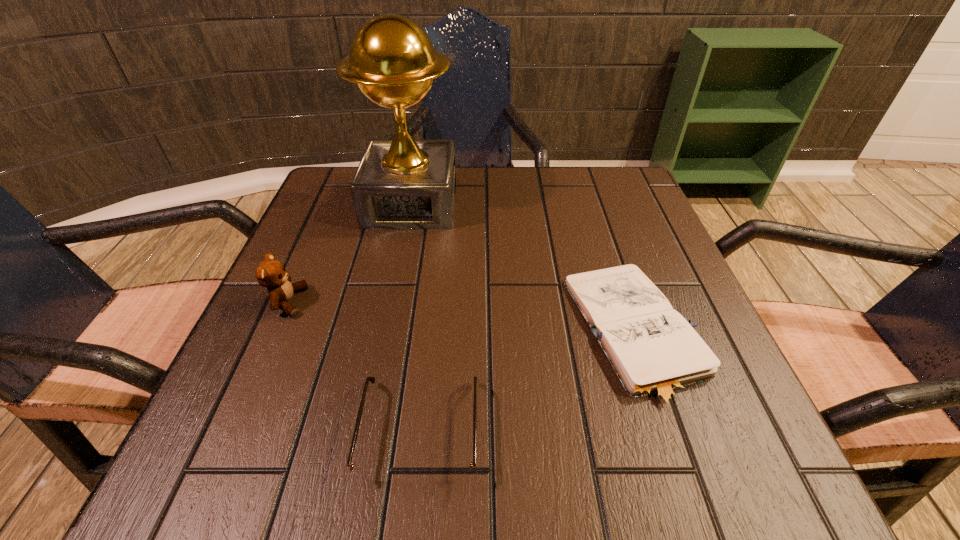
The image size is (960, 540). Find the location of `the farthest object`. the farthest object is located at coordinates (403, 183).

This screenshot has height=540, width=960. What are the coordinates of `award` in the screenshot? It's located at (403, 183).

This screenshot has height=540, width=960. I want to click on the third shortest object, so [270, 273].

You are a GUI agent. You are given a task and a screenshot of the screen. Output one action in this format:
    pyautogui.click(x=<x>, y=<y>)
    Task: Click on the teddy bear
    
    Given the screenshot: What is the action you would take?
    pyautogui.click(x=270, y=273)

Where is `the third tallest object`? the third tallest object is located at coordinates (371, 474).

This screenshot has height=540, width=960. Identify the location of notebook. click(x=655, y=353).

Identify the location of the rightmost object. The image size is (960, 540). (655, 353).

Locate an element on the screen. This screenshot has height=540, width=960. free space located 0.100m on the front-facing side of the farthest object is located at coordinates (399, 262).

You are a GUI agent. You are given a task and a screenshot of the screen. Output one action in this format:
    pyautogui.click(x=<x>, y=<y>)
    Task: Click on the free spot located 0.360m on the front-facing side of the leftmost object
    This screenshot has width=960, height=540.
    Given the screenshot: What is the action you would take?
    pyautogui.click(x=510, y=302)

Where is `free spot located 0.370m on the back of the rightmost object`? Image resolution: width=960 pixels, height=540 pixels. free spot located 0.370m on the back of the rightmost object is located at coordinates (583, 170).